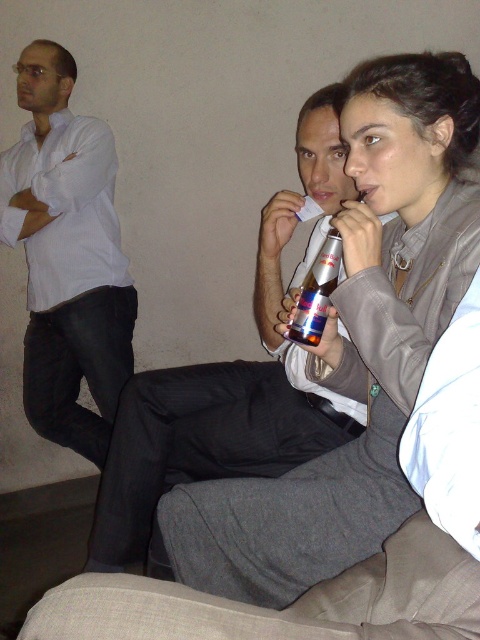
Does dark gray suit at center have a lesser height compared to red metallic can at center?

In fact, dark gray suit at center may be taller than red metallic can at center.

In the scene shown: Can you confirm if dark gray suit at center is positioned to the right of red metallic can at center?

No, dark gray suit at center is not to the right of red metallic can at center.

Does point (264, 340) lie in front of point (325, 259)?

No.

Where is `dark gray suit at center`? Image resolution: width=480 pixels, height=640 pixels. dark gray suit at center is located at coordinates (216, 417).

Does white shirt at left come behind red metallic can at center?

Yes.

Between white shirt at left and red metallic can at center, which one is positioned lower?

red metallic can at center

Who is more forward, (67, 429) or (312, 308)?

Positioned in front is point (312, 308).

I want to click on white shirt at left, so click(67, 257).

In the scene shown: Measure the distance between dark gray suit at center and white shirt at left.

dark gray suit at center is 33.28 inches away from white shirt at left.

Is dark gray suit at center to the left of white shirt at left from the viewer's perspective?

No, dark gray suit at center is not to the left of white shirt at left.

You are a GUI agent. You are given a task and a screenshot of the screen. Output one action in this format:
    pyautogui.click(x=<x>, y=<y>)
    Task: Click on the dark gray suit at center
    The height and width of the screenshot is (640, 480).
    Given the screenshot: What is the action you would take?
    pyautogui.click(x=216, y=417)

Image resolution: width=480 pixels, height=640 pixels. I want to click on dark gray suit at center, so click(216, 417).